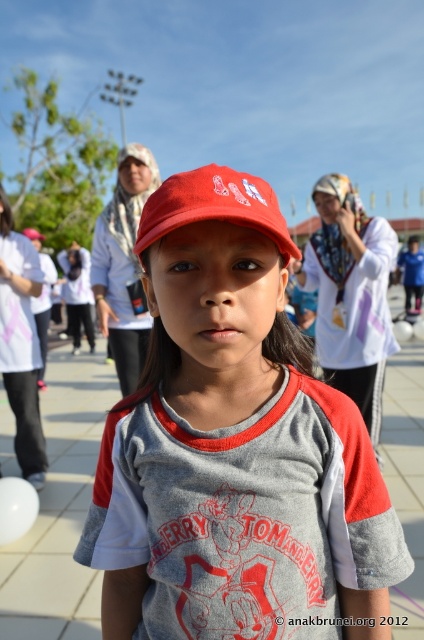
You are a photographer at the event and want to take a photo of the child. The camera can only focus on objects within a 7 inch range. Are both the matte red cap at center and the matte red baseball cap at center within the camera focus range?

The matte red cap at center and the matte red baseball cap at center are 7.74 inches apart from each other, which exceeds the camera focus range of 7 inches. Therefore, both objects may not be in focus simultaneously.